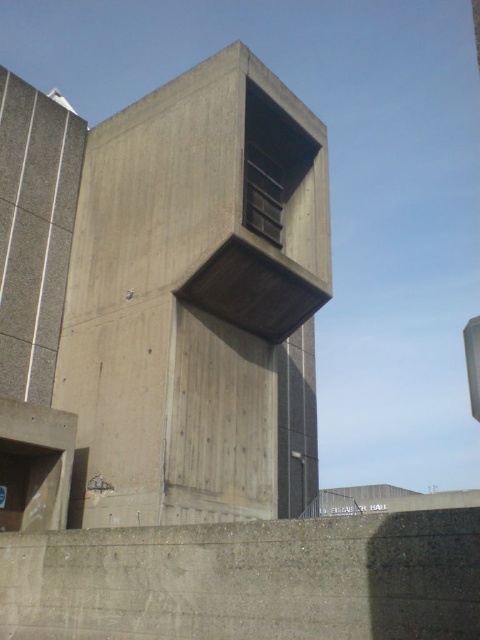
Question: Which object is farther from the camera taking this photo?

Choices:
 (A) concrete/rough tower at center
 (B) gray concrete wall at lower center

Answer: (A)

Question: Can you confirm if concrete/rough tower at center is positioned below gray concrete wall at lower center?

Choices:
 (A) no
 (B) yes

Answer: (A)

Question: In this image, where is concrete/rough tower at center located relative to gray concrete wall at lower center?

Choices:
 (A) left
 (B) right

Answer: (B)

Question: Is concrete/rough tower at center in front of gray concrete wall at lower center?

Choices:
 (A) no
 (B) yes

Answer: (A)